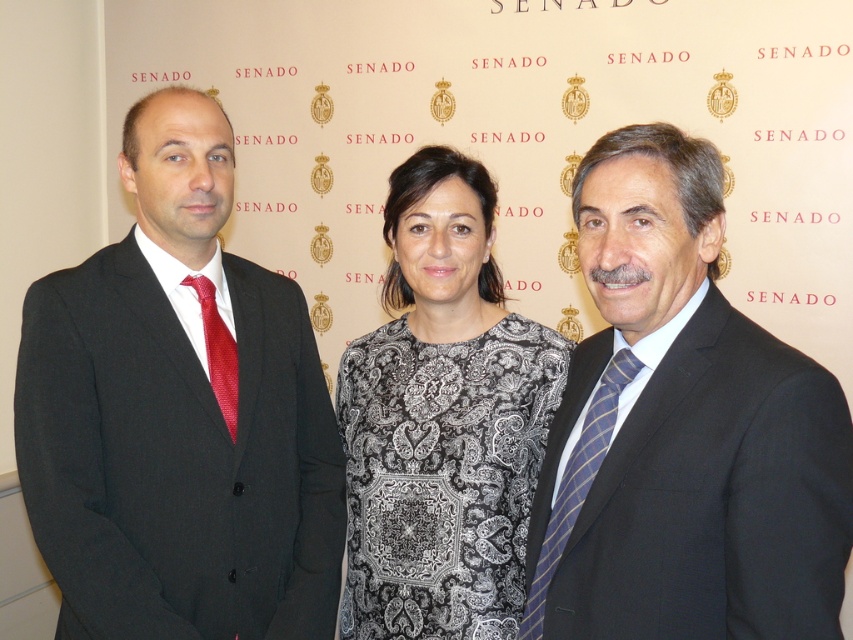
Question: Where is matte black suit at right located in relation to blue striped tie at right in the image?

Choices:
 (A) left
 (B) right

Answer: (B)

Question: Can you confirm if blue striped tie at right is thinner than shiny red tie at left?

Choices:
 (A) no
 (B) yes

Answer: (A)

Question: Estimate the real-world distances between objects in this image. Which object is closer to the black lace dress at center?

Choices:
 (A) shiny red tie at left
 (B) matte black suit at right
 (C) blue striped tie at right

Answer: (A)

Question: Does black lace dress at center appear under blue striped tie at right?

Choices:
 (A) yes
 (B) no

Answer: (B)

Question: Which object is the closest to the blue striped tie at right?

Choices:
 (A) black lace dress at center
 (B) matte black suit at left
 (C) matte black suit at right

Answer: (C)

Question: Which of the following is the closest to the observer?

Choices:
 (A) black lace dress at center
 (B) matte black suit at left
 (C) shiny red tie at left

Answer: (B)